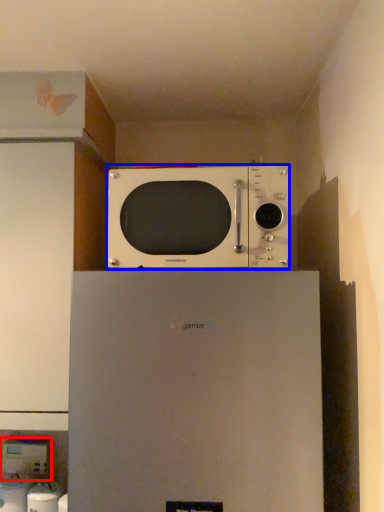
Question: Which object appears closest to the camera in this image, appliance (highlighted by a red box) or microwave oven (highlighted by a blue box)?

Choices:
 (A) appliance
 (B) microwave oven

Answer: (B)